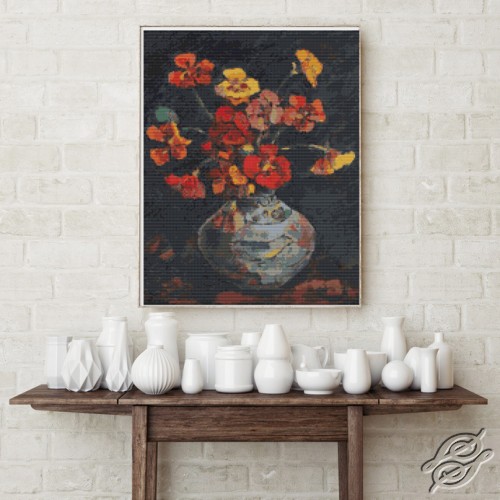
At what (x,y) coordinates should I click in order to perform the action: click on artwork. Please return your answer as a coordinate pair (x, y). The height and width of the screenshot is (500, 500). Looking at the image, I should click on (345, 235).